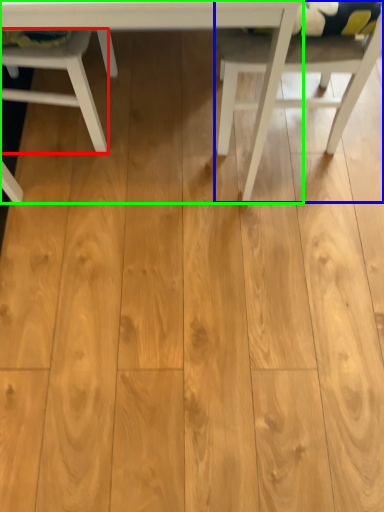
Question: Considering the real-world distances, which object is closest to chair (highlighted by a red box)? chair (highlighted by a blue box) or table (highlighted by a green box).

Choices:
 (A) chair
 (B) table

Answer: (B)